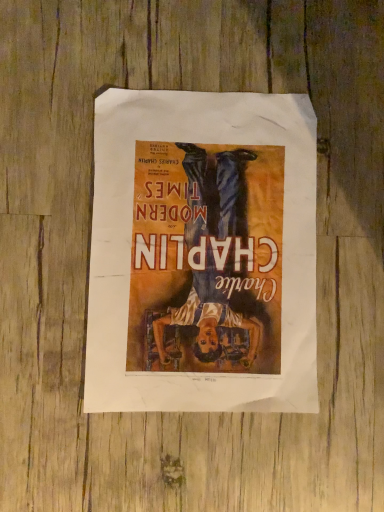
The width and height of the screenshot is (384, 512). What do you see at coordinates (202, 253) in the screenshot?
I see `matte paper poster at center` at bounding box center [202, 253].

Where is `matte paper poster at center`? matte paper poster at center is located at coordinates (202, 253).

Find the location of a particular element. The image size is (384, 512). matte paper poster at center is located at coordinates (202, 253).